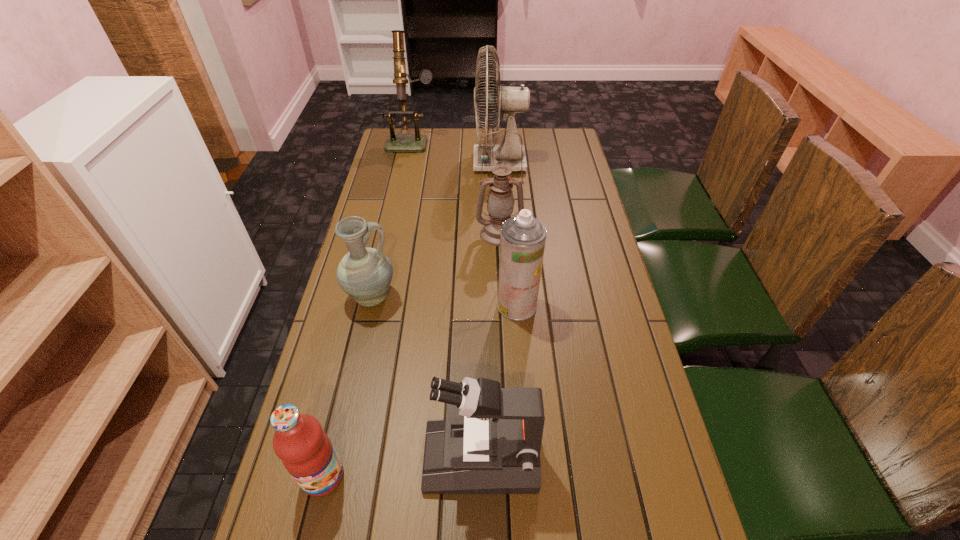
Identify the location of free space that satisfies the following two spatial constraints: 1. at the eyepiece of the left microscope; 2. on the handle side of the pitcher. The width and height of the screenshot is (960, 540). (378, 298).

The image size is (960, 540). What are the coordinates of `vacant space that satisfies the following two spatial constraints: 1. on the back side of the aerosol can; 2. on the handle side of the pitcher` in the screenshot? It's located at (516, 298).